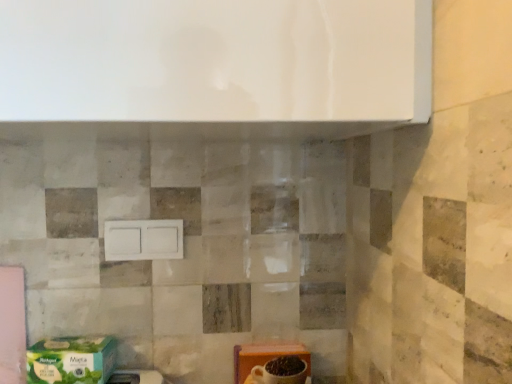
Question: Is orange cardboard box at lower right, which appears as the first cardboard box when viewed from the right, turned away from white matte switch at center?

Choices:
 (A) yes
 (B) no

Answer: (B)

Question: Can you confirm if orange cardboard box at lower right, which appears as the first cardboard box when viewed from the right, is positioned to the left of white matte switch at center?

Choices:
 (A) no
 (B) yes

Answer: (A)

Question: Can you confirm if orange cardboard box at lower right, which is the 2th cardboard box in left-to-right order, is wider than white matte switch at center?

Choices:
 (A) yes
 (B) no

Answer: (A)

Question: Can white matte switch at center be found inside orange cardboard box at lower right, which appears as the first cardboard box when viewed from the right?

Choices:
 (A) no
 (B) yes

Answer: (A)

Question: Could you tell me if orange cardboard box at lower right, which appears as the first cardboard box when viewed from the right, is turned towards white matte switch at center?

Choices:
 (A) yes
 (B) no

Answer: (B)

Question: Is orange cardboard box at lower right, which appears as the first cardboard box when viewed from the right, located outside white matte switch at center?

Choices:
 (A) no
 (B) yes

Answer: (B)

Question: Is green matte cardboard box at lower left, which appears as the first cardboard box when viewed from the left, shorter than orange cardboard box at lower right, which appears as the first cardboard box when viewed from the right?

Choices:
 (A) yes
 (B) no

Answer: (A)

Question: From the image's perspective, is green matte cardboard box at lower left, placed as the 2th cardboard box when sorted from right to left, located beneath orange cardboard box at lower right, which is the 2th cardboard box in left-to-right order?

Choices:
 (A) no
 (B) yes

Answer: (A)

Question: Is green matte cardboard box at lower left, which appears as the first cardboard box when viewed from the left, closer to camera compared to orange cardboard box at lower right, which appears as the first cardboard box when viewed from the right?

Choices:
 (A) no
 (B) yes

Answer: (B)

Question: From a real-world perspective, is green matte cardboard box at lower left, which appears as the first cardboard box when viewed from the left, located higher than orange cardboard box at lower right, which appears as the first cardboard box when viewed from the right?

Choices:
 (A) no
 (B) yes

Answer: (B)

Question: Is green matte cardboard box at lower left, placed as the 2th cardboard box when sorted from right to left, completely or partially outside of orange cardboard box at lower right, which is the 2th cardboard box in left-to-right order?

Choices:
 (A) yes
 (B) no

Answer: (A)

Question: Is there a large distance between green matte cardboard box at lower left, placed as the 2th cardboard box when sorted from right to left, and orange cardboard box at lower right, which is the 2th cardboard box in left-to-right order?

Choices:
 (A) yes
 (B) no

Answer: (B)

Question: Considering the relative positions of green matte cardboard box at lower left, which appears as the first cardboard box when viewed from the left, and white matte switch at center in the image provided, is green matte cardboard box at lower left, which appears as the first cardboard box when viewed from the left, behind white matte switch at center?

Choices:
 (A) no
 (B) yes

Answer: (A)